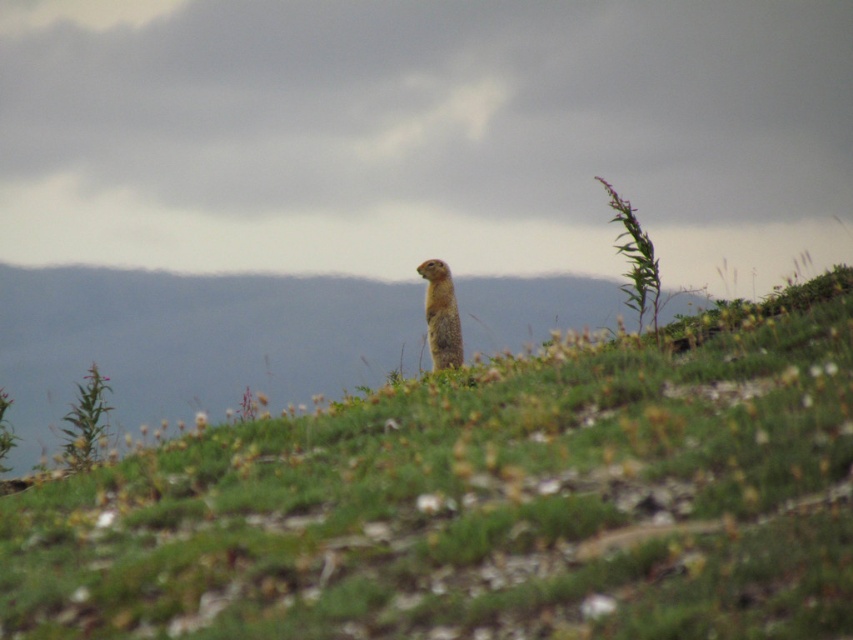
Question: From the image, what is the correct spatial relationship of green grassy at center in relation to furry brown squirrel at center?

Choices:
 (A) right
 (B) left

Answer: (B)

Question: Does green grassy at center have a larger size compared to furry brown squirrel at center?

Choices:
 (A) no
 (B) yes

Answer: (B)

Question: Which of the following is the closest to the observer?

Choices:
 (A) green grassy at center
 (B) furry brown squirrel at center

Answer: (A)

Question: Does green grassy at center have a greater width compared to furry brown squirrel at center?

Choices:
 (A) no
 (B) yes

Answer: (B)

Question: Which of the following is the farthest from the observer?

Choices:
 (A) furry brown squirrel at center
 (B) green grassy at center

Answer: (A)